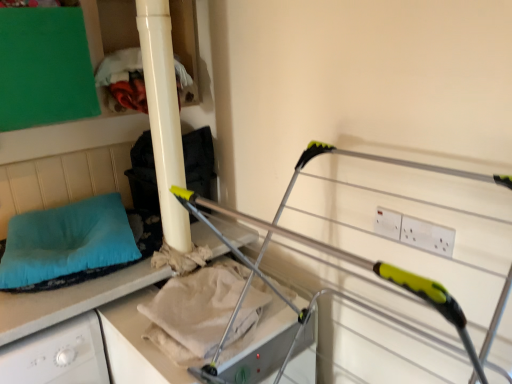
Question: Considering the relative sizes of beige cotton sheet at center and matte white pillar at upper left in the image provided, is beige cotton sheet at center smaller than matte white pillar at upper left?

Choices:
 (A) yes
 (B) no

Answer: (A)

Question: Is beige cotton sheet at center located outside matte white pillar at upper left?

Choices:
 (A) yes
 (B) no

Answer: (A)

Question: Considering the relative positions of beige cotton sheet at center and matte white pillar at upper left in the image provided, is beige cotton sheet at center in front of matte white pillar at upper left?

Choices:
 (A) no
 (B) yes

Answer: (B)

Question: Can you confirm if beige cotton sheet at center is bigger than matte white pillar at upper left?

Choices:
 (A) yes
 (B) no

Answer: (B)

Question: From a real-world perspective, does beige cotton sheet at center stand above matte white pillar at upper left?

Choices:
 (A) no
 (B) yes

Answer: (A)

Question: Considering the relative sizes of beige cotton sheet at center and matte white pillar at upper left in the image provided, is beige cotton sheet at center taller than matte white pillar at upper left?

Choices:
 (A) no
 (B) yes

Answer: (A)

Question: Can you confirm if metallic silver drying rack at center is bigger than teal fabric pillow at left?

Choices:
 (A) yes
 (B) no

Answer: (A)

Question: Is metallic silver drying rack at center at the right side of teal fabric pillow at left?

Choices:
 (A) no
 (B) yes

Answer: (B)

Question: Does metallic silver drying rack at center lie behind teal fabric pillow at left?

Choices:
 (A) yes
 (B) no

Answer: (B)

Question: Are metallic silver drying rack at center and teal fabric pillow at left far apart?

Choices:
 (A) yes
 (B) no

Answer: (B)

Question: Does metallic silver drying rack at center have a lesser height compared to teal fabric pillow at left?

Choices:
 (A) no
 (B) yes

Answer: (A)

Question: Is metallic silver drying rack at center oriented away from teal fabric pillow at left?

Choices:
 (A) yes
 (B) no

Answer: (B)

Question: From the image's perspective, is teal fabric pillow at left under metallic silver drying rack at center?

Choices:
 (A) yes
 (B) no

Answer: (B)